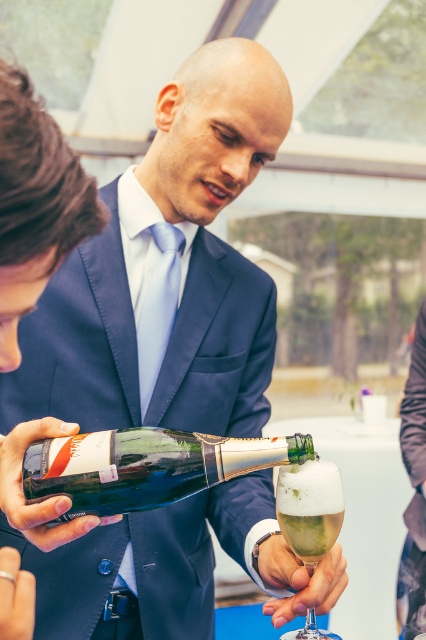
You are a bartender at this event and need to ensure that the clear glass wine glass at center can hold the clear glass wine at center without spilling. Based on their sizes, is this possible?

The clear glass wine glass at center is taller than the clear glass wine at center, so it can hold the wine without spilling.

You are a bartender at a formal event and need to determine if the shiny metallic champagne bottle at center can fit into a storage compartment designed to hold items no wider than the clear glass wine glass at center. Based on the scene description, can the champagne bottle fit?

The shiny metallic champagne bottle at center might be wider than the clear glass wine glass at center, so it may not fit into the storage compartment designed for items no wider than the wine glass.